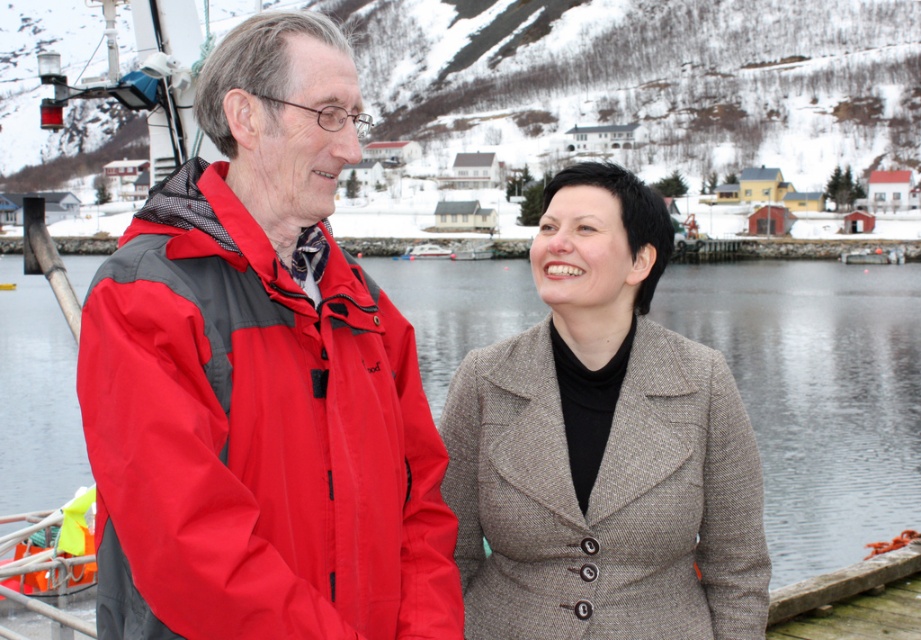
Question: Considering the relative positions of matte red jacket at left and brown woolen coat at center in the image provided, where is matte red jacket at left located with respect to brown woolen coat at center?

Choices:
 (A) above
 (B) below

Answer: (B)

Question: Which object is closer to the camera taking this photo?

Choices:
 (A) brown woolen coat at center
 (B) matte red jacket at left

Answer: (B)

Question: Does matte red jacket at left appear on the right side of brown woolen coat at center?

Choices:
 (A) no
 (B) yes

Answer: (A)

Question: Which of the following is the farthest from the observer?

Choices:
 (A) (183, 454)
 (B) (580, 252)

Answer: (B)

Question: Does matte red jacket at left appear over brown woolen coat at center?

Choices:
 (A) no
 (B) yes

Answer: (A)